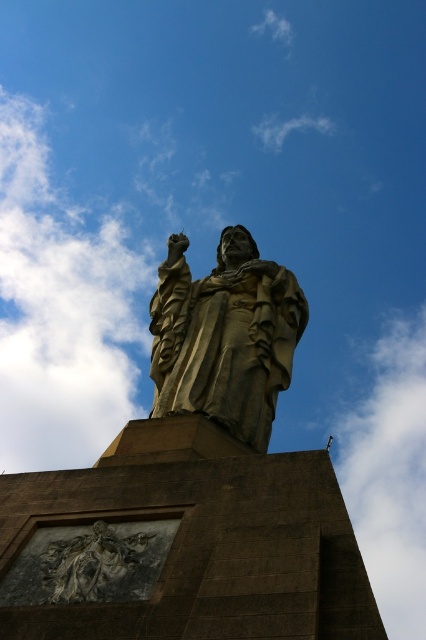
Which is below, white fluffy cloud at upper right or rustic stone carving at lower left?

white fluffy cloud at upper right is lower down.

Which of these two, white fluffy cloud at upper right or rustic stone carving at lower left, stands shorter?

rustic stone carving at lower left

Does point (374, 577) lie in front of point (65, 554)?

No, it is behind (65, 554).

Image resolution: width=426 pixels, height=640 pixels. Find the location of `white fluffy cloud at upper right`. white fluffy cloud at upper right is located at coordinates (391, 474).

Does point (11, 381) come behind point (86, 573)?

That is True.

In the scene shown: Who is more forward, (5, 172) or (80, 592)?

Positioned in front is point (80, 592).

Is point (36, 131) farther from viewer compared to point (66, 576)?

Yes, point (36, 131) is behind point (66, 576).

You are a GUI agent. You are given a task and a screenshot of the screen. Output one action in this format:
    pyautogui.click(x=<x>, y=<y>)
    Task: Click on the white fluffy cloud at upper left
    
    Given the screenshot: What is the action you would take?
    pyautogui.click(x=60, y=310)

Is white fluffy cloud at upper left wider than white fluffy cloud at upper right?

Yes, white fluffy cloud at upper left is wider than white fluffy cloud at upper right.

Measure the distance between white fluffy cloud at upper left and camera.

white fluffy cloud at upper left and camera are 169.22 meters apart from each other.

Locate an element on the screen. The image size is (426, 640). white fluffy cloud at upper left is located at coordinates (60, 310).